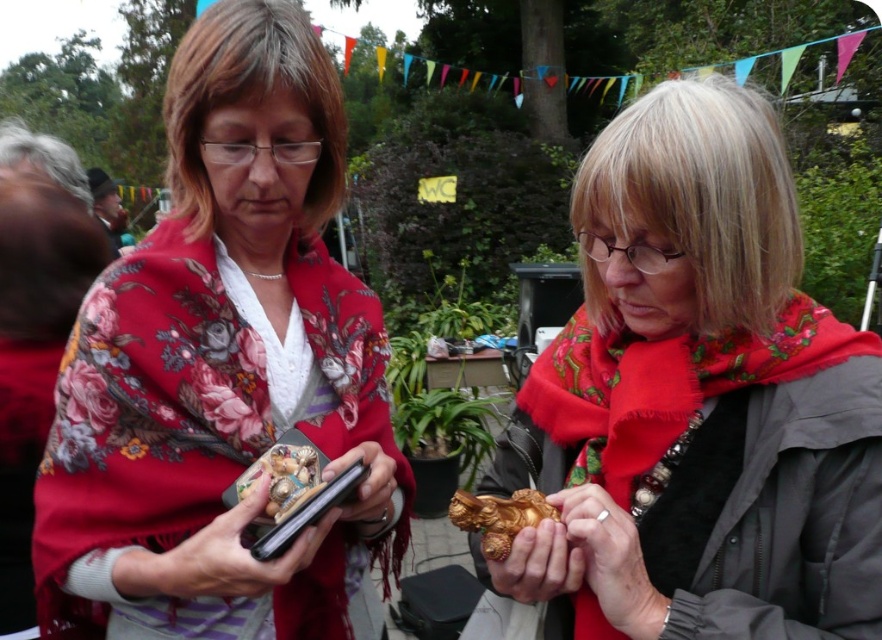
Is gold metallic ornament at center taller than matte black phone at center?

No, gold metallic ornament at center is not taller than matte black phone at center.

Between gold metallic ornament at center and matte black phone at center, which one has more height?

Standing taller between the two is matte black phone at center.

The width and height of the screenshot is (882, 640). Identify the location of gold metallic ornament at center. (537, 564).

Does gold textured ornament at center appear on the left side of gold metallic ornament at center?

Indeed, gold textured ornament at center is positioned on the left side of gold metallic ornament at center.

The width and height of the screenshot is (882, 640). What do you see at coordinates (232, 554) in the screenshot? I see `gold textured ornament at center` at bounding box center [232, 554].

You are a GUI agent. You are given a task and a screenshot of the screen. Output one action in this format:
    pyautogui.click(x=<x>, y=<y>)
    Task: Click on the gold textured ornament at center
    This screenshot has height=640, width=882.
    Given the screenshot: What is the action you would take?
    pyautogui.click(x=232, y=554)

Is point (581, 579) behind point (355, 460)?

No, it is not.

Does gold metallic ornament at lower center come in front of matte black phone at center?

Yes, it is in front of matte black phone at center.

Who is more forward, (587, 531) or (350, 504)?

Point (587, 531)

Locate an element on the screen. The image size is (882, 640). gold metallic ornament at lower center is located at coordinates (610, 561).